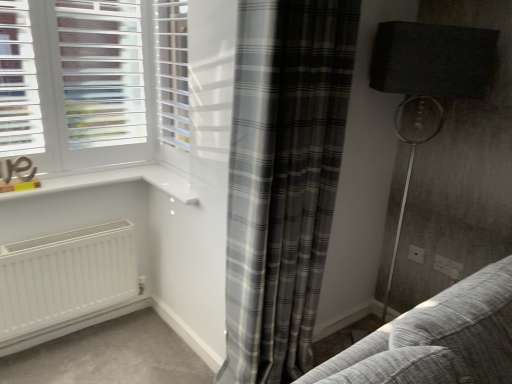
Question: Is gray plaid curtain at center smaller than white plastic blinds at upper center?

Choices:
 (A) yes
 (B) no

Answer: (B)

Question: Is gray plaid curtain at center completely or partially outside of white plastic blinds at upper center?

Choices:
 (A) yes
 (B) no

Answer: (A)

Question: Does gray plaid curtain at center contain white plastic blinds at upper center?

Choices:
 (A) no
 (B) yes

Answer: (A)

Question: Considering the relative positions of gray plaid curtain at center and white plastic blinds at upper center in the image provided, is gray plaid curtain at center in front of white plastic blinds at upper center?

Choices:
 (A) yes
 (B) no

Answer: (A)

Question: Are gray plaid curtain at center and white plastic blinds at upper center far apart?

Choices:
 (A) yes
 (B) no

Answer: (B)

Question: Is the position of gray plaid curtain at center more distant than that of white plastic blinds at upper center?

Choices:
 (A) yes
 (B) no

Answer: (B)

Question: Is white plastic electric outlet at lower right, the 1th electric outlet in the front-to-back sequence, located outside matte black lampshade at right?

Choices:
 (A) no
 (B) yes

Answer: (B)

Question: Can you confirm if white plastic electric outlet at lower right, which is the second electric outlet from left to right, is bigger than matte black lampshade at right?

Choices:
 (A) no
 (B) yes

Answer: (A)

Question: From a real-world perspective, is white plastic electric outlet at lower right, which is counted as the 2th electric outlet, starting from the back, positioned under matte black lampshade at right based on gravity?

Choices:
 (A) no
 (B) yes

Answer: (B)

Question: Is the depth of white plastic electric outlet at lower right, which is counted as the 2th electric outlet, starting from the back, greater than that of matte black lampshade at right?

Choices:
 (A) no
 (B) yes

Answer: (B)

Question: Can you confirm if white plastic electric outlet at lower right, which is the second electric outlet from left to right, is smaller than matte black lampshade at right?

Choices:
 (A) yes
 (B) no

Answer: (A)

Question: Does white plastic electric outlet at lower right, the 1th electric outlet in the front-to-back sequence, have a lesser height compared to matte black lampshade at right?

Choices:
 (A) yes
 (B) no

Answer: (A)

Question: Is matte black lampshade at right completely or partially inside white plastic blinds at upper center?

Choices:
 (A) yes
 (B) no

Answer: (B)